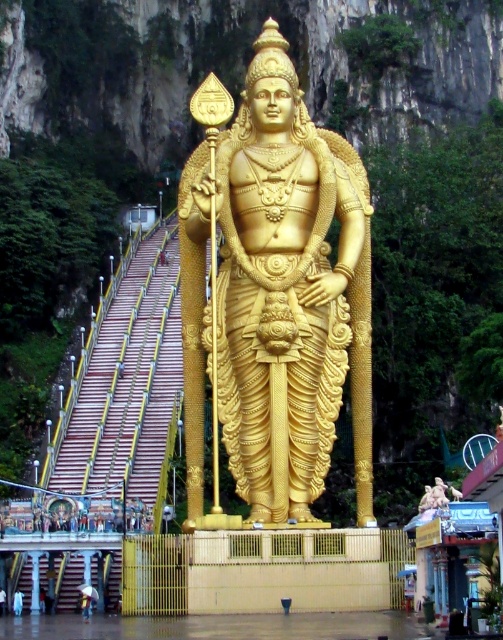
Question: Among these objects, which one is nearest to the camera?

Choices:
 (A) golden statue at center
 (B) gold polished statue at center

Answer: (B)

Question: Which point is farther to the camera?

Choices:
 (A) gold polished statue at center
 (B) golden statue at center

Answer: (B)

Question: Is gold polished statue at center in front of golden statue at center?

Choices:
 (A) no
 (B) yes

Answer: (B)

Question: Can you confirm if gold polished statue at center is positioned above golden statue at center?

Choices:
 (A) yes
 (B) no

Answer: (A)

Question: Which object appears farthest from the camera in this image?

Choices:
 (A) golden statue at center
 (B) gold polished statue at center

Answer: (A)

Question: Is gold polished statue at center smaller than golden statue at center?

Choices:
 (A) yes
 (B) no

Answer: (B)